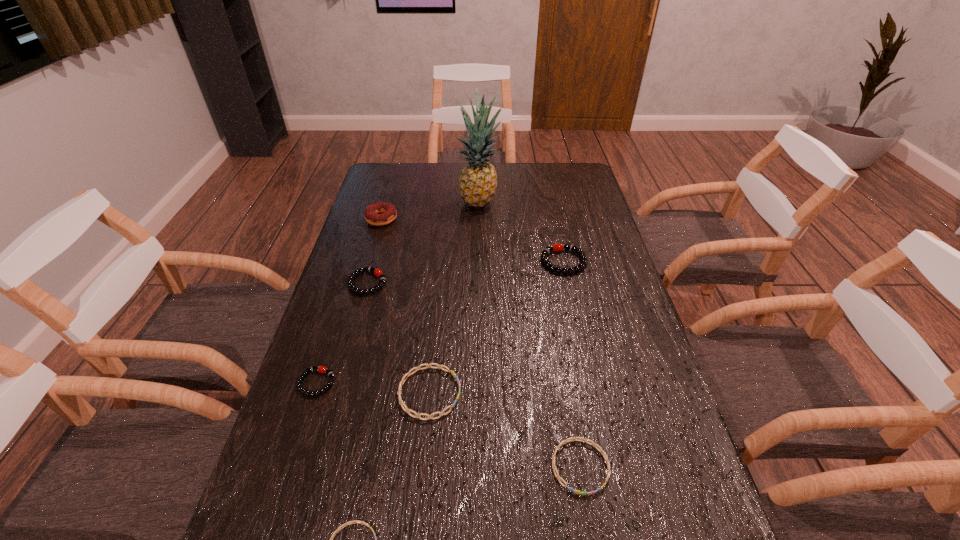
At what (x,y) coordinates should I click in order to perform the action: click on vacant space at the far edge. Please return your answer as a coordinate pair (x, y). The width and height of the screenshot is (960, 540). Looking at the image, I should click on (440, 181).

Where is `free space at the left edge of the desktop`? free space at the left edge of the desktop is located at coordinates (317, 526).

This screenshot has height=540, width=960. Find the location of `vacant region at the right edge of the desktop`. vacant region at the right edge of the desktop is located at coordinates (612, 326).

In the image, there is a desktop. Where is `free space at the far right corner`? free space at the far right corner is located at coordinates (578, 167).

The height and width of the screenshot is (540, 960). In order to click on vacant area that lies between the second smallest black bracelet and the biggest black bracelet in this screenshot , I will do `click(466, 272)`.

Find the location of `unoccupied position between the second tallest object and the pineapple`. unoccupied position between the second tallest object and the pineapple is located at coordinates (430, 210).

Where is `free space that is in between the pineapple and the fifth farthest bracelet`? The width and height of the screenshot is (960, 540). free space that is in between the pineapple and the fifth farthest bracelet is located at coordinates (530, 334).

This screenshot has width=960, height=540. In order to click on vacant space that is in between the second nearest bracelet and the second biggest black bracelet in this screenshot , I will do `click(474, 375)`.

The image size is (960, 540). I want to click on free space between the nearest black bracelet and the second smallest black bracelet, so click(342, 333).

I want to click on vacant area between the smallest black bracelet and the second nearest bracelet, so click(x=448, y=424).